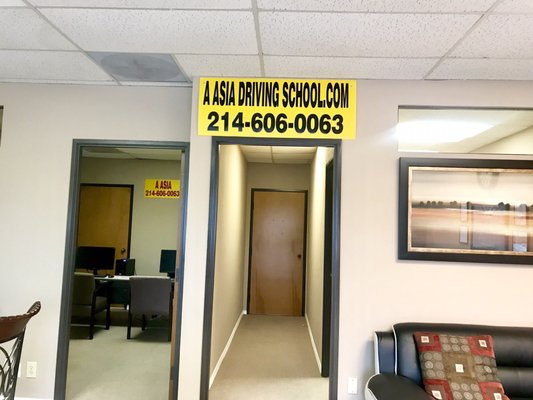
In order to click on monitors in this screenshot , I will do `click(96, 253)`, `click(169, 258)`, `click(130, 267)`.